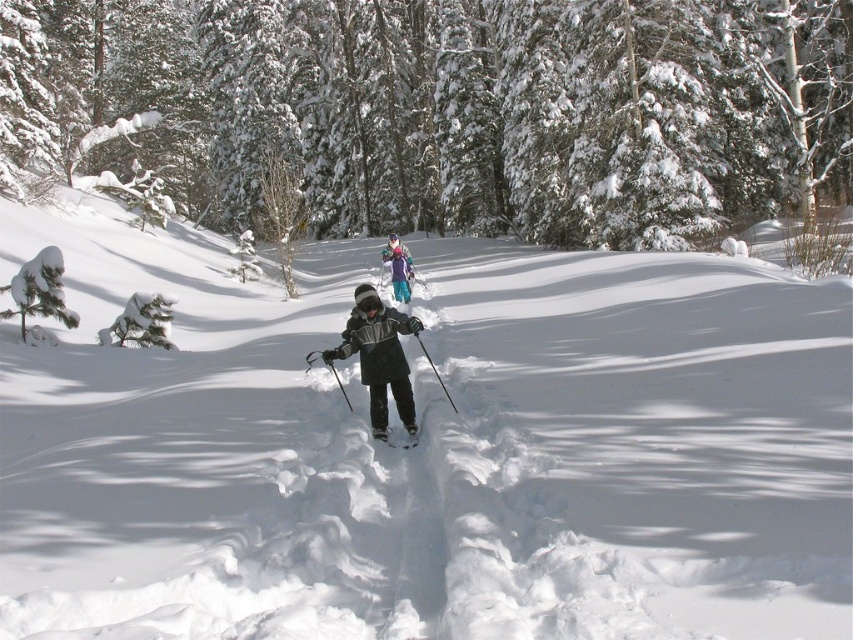
Is white snow ski slope at center to the left of white matte ski at center from the viewer's perspective?

Correct, you'll find white snow ski slope at center to the left of white matte ski at center.

Can you confirm if white snow ski slope at center is taller than white matte ski at center?

Correct, white snow ski slope at center is much taller as white matte ski at center.

Is point (56, 492) positioned after point (415, 433)?

No, (56, 492) is closer to viewer.

Where is `white snow ski slope at center`? white snow ski slope at center is located at coordinates click(x=425, y=449).

Can you confirm if dark gray fleece jacket at center is positioned below white matte ski at center?

No.

Describe the element at coordinates (379, 355) in the screenshot. I see `dark gray fleece jacket at center` at that location.

This screenshot has width=853, height=640. What are the coordinates of `dark gray fleece jacket at center` in the screenshot? It's located at (379, 355).

Can you confirm if white snow ski slope at center is positioned to the left of purple fleece jacket at center?

Correct, you'll find white snow ski slope at center to the left of purple fleece jacket at center.

Looking at this image, who is more distant from viewer, (496,513) or (393,262)?

The point (393,262) is behind.

This screenshot has width=853, height=640. Describe the element at coordinates (425, 449) in the screenshot. I see `white snow ski slope at center` at that location.

Where is `white snow ski slope at center`? The width and height of the screenshot is (853, 640). white snow ski slope at center is located at coordinates (425, 449).